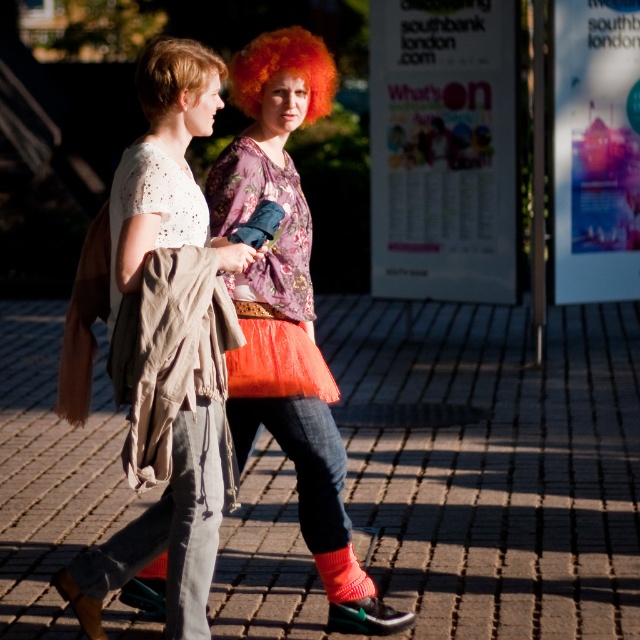
Question: Which is nearer to the brick pavement at center?

Choices:
 (A) short blonde hair at upper left
 (B) orange curly wig at upper center
 (C) orange tulle skirt at center

Answer: (C)

Question: Is orange tulle skirt at center behind orange curly wig at upper center?

Choices:
 (A) no
 (B) yes

Answer: (A)

Question: In this image, where is brick pavement at center located relative to short blonde hair at upper left?

Choices:
 (A) below
 (B) above

Answer: (A)

Question: Can you confirm if brick pavement at center is smaller than short blonde hair at upper left?

Choices:
 (A) yes
 (B) no

Answer: (B)

Question: Which is farther from the orange tulle skirt at center?

Choices:
 (A) knitted orange sock at lower center
 (B) orange curly wig at upper center

Answer: (B)

Question: Which object appears farthest from the camera in this image?

Choices:
 (A) matte beige scarf at center
 (B) orange curly wig at upper center
 (C) orange tulle skirt at center

Answer: (B)